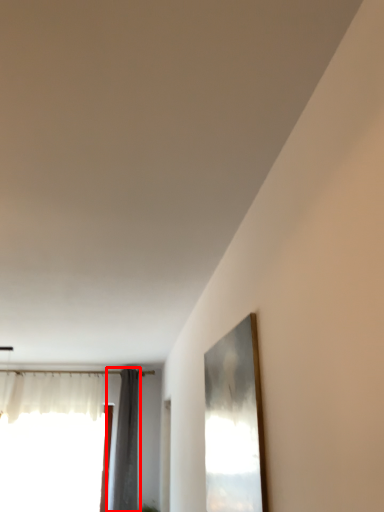
Question: From the image's perspective, where is curtain (annotated by the red box) located in relation to window in the image?

Choices:
 (A) below
 (B) above

Answer: (B)